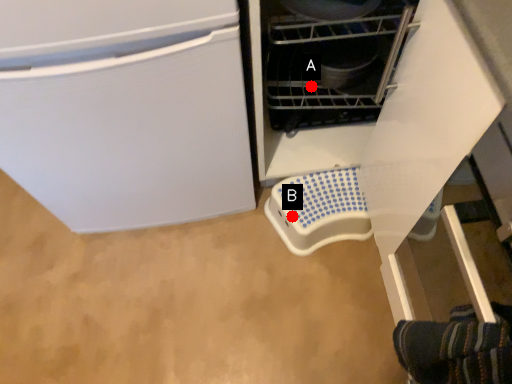
Question: Two points are circled on the image, labeled by A and B beside each circle. Which point is closer to the camera?

Choices:
 (A) A is closer
 (B) B is closer

Answer: (A)